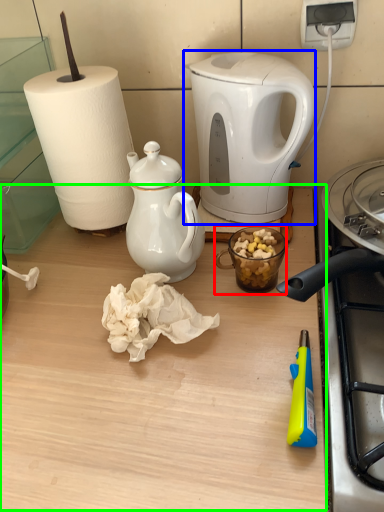
Question: Which is nearer to the coffee cup (highlighted by a red box)? kettle (highlighted by a blue box) or table (highlighted by a green box).

Choices:
 (A) kettle
 (B) table

Answer: (A)